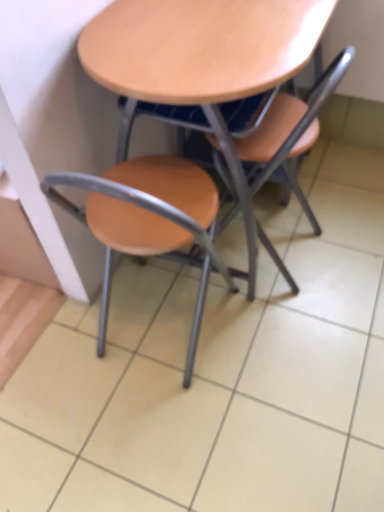
Question: Is matte wood chair at center, acting as the first chair starting from the right, to the left or to the right of wooden at center in the image?

Choices:
 (A) left
 (B) right

Answer: (B)

Question: From the image's perspective, relative to wooden at center, is matte wood chair at center, acting as the first chair starting from the right, above or below?

Choices:
 (A) below
 (B) above

Answer: (A)

Question: Which object is positioned farthest from the matte wood chair at center, marked as the 2th chair in a right-to-left arrangement?

Choices:
 (A) wooden at center
 (B) matte wood chair at center, acting as the first chair starting from the right

Answer: (A)

Question: Which object is the farthest from the matte wood chair at center, the 1th chair when ordered from left to right?

Choices:
 (A) wooden at center
 (B) matte wood chair at center, which is the second chair in left-to-right order

Answer: (A)